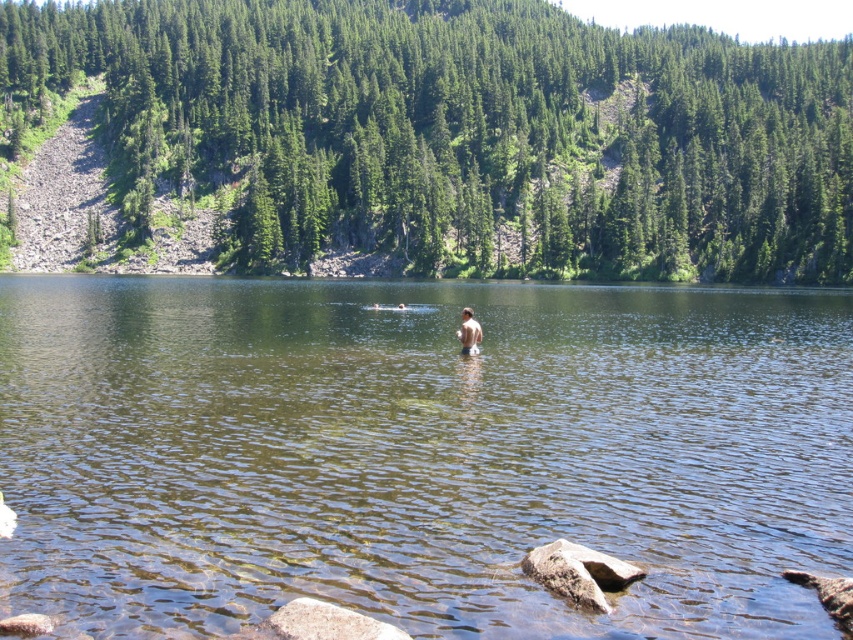
Which is above, gray rough rock at lower center or light brown skin at center?

Positioned higher is light brown skin at center.

Is gray rough rock at lower center below light brown skin at center?

Yes.

This screenshot has width=853, height=640. What do you see at coordinates (323, 624) in the screenshot?
I see `gray rough rock at lower center` at bounding box center [323, 624].

Identify the location of gray rough rock at lower center. (x=323, y=624).

Does clear water at center appear under green textured pine at upper center?

Yes, clear water at center is below green textured pine at upper center.

Does clear water at center appear on the left side of green textured pine at upper center?

Indeed, clear water at center is positioned on the left side of green textured pine at upper center.

Consider the image. Who is more distant from viewer, (473, 412) or (448, 33)?

The point (448, 33) is more distant.

You are a GUI agent. You are given a task and a screenshot of the screen. Output one action in this format:
    pyautogui.click(x=<x>, y=<y>)
    Task: Click on the clear water at center
    This screenshot has height=640, width=853.
    Given the screenshot: What is the action you would take?
    pyautogui.click(x=421, y=452)

Between point (619, 109) and point (459, 336), which one is positioned in front?

Point (459, 336)

Is green textured pine at upper center smaller than light brown skin at center?

No, green textured pine at upper center is not smaller than light brown skin at center.

I want to click on green textured pine at upper center, so click(x=460, y=132).